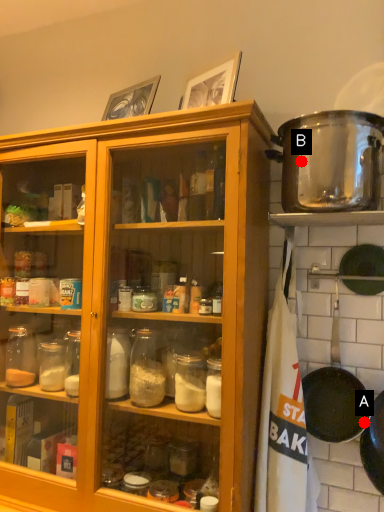
Question: Two points are circled on the image, labeled by A and B beside each circle. Which point is closer to the camera taking this photo?

Choices:
 (A) A is closer
 (B) B is closer

Answer: (B)